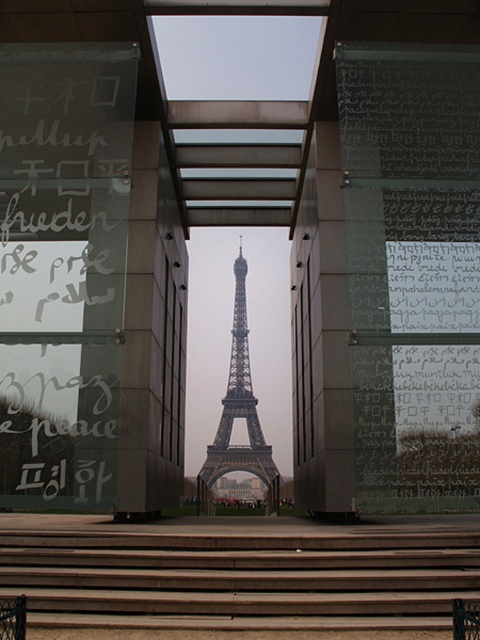
Is brown wooden stairs at center wider than metallic gray eiffel tower at center?

Indeed, brown wooden stairs at center has a greater width compared to metallic gray eiffel tower at center.

The height and width of the screenshot is (640, 480). In order to click on brown wooden stairs at center in this screenshot , I will do `click(240, 579)`.

You are a GUI agent. You are given a task and a screenshot of the screen. Output one action in this format:
    pyautogui.click(x=<x>, y=<y>)
    Task: Click on the brown wooden stairs at center
    
    Given the screenshot: What is the action you would take?
    pyautogui.click(x=240, y=579)